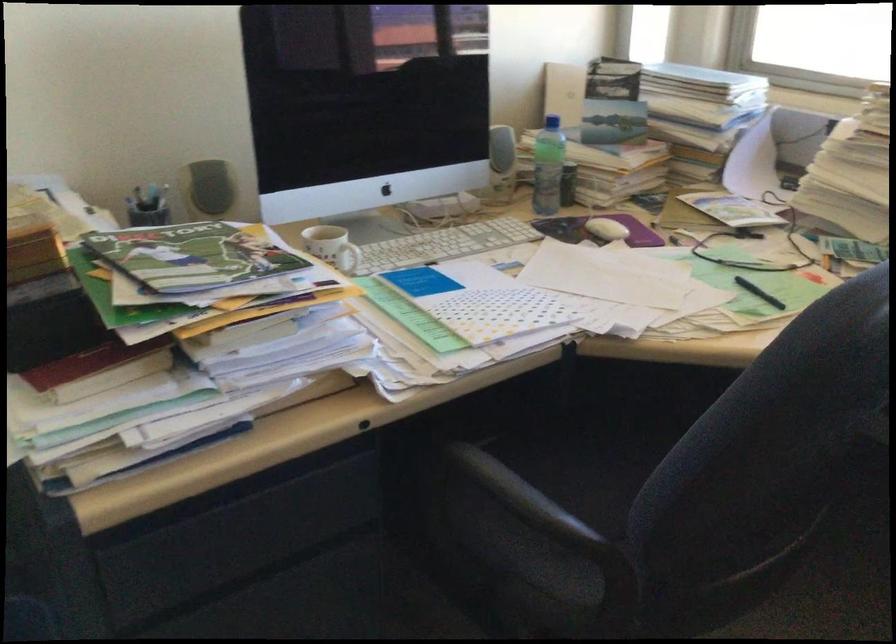
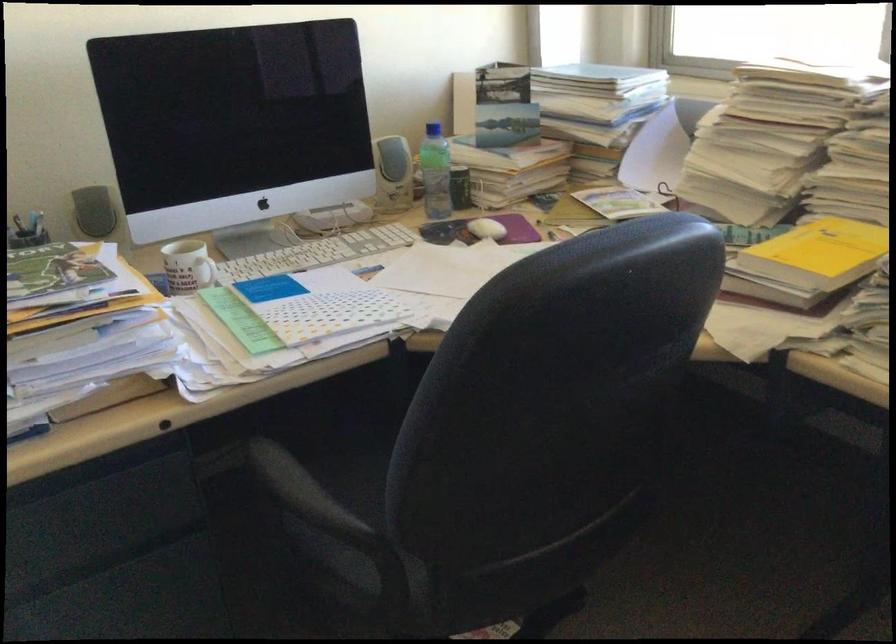
In the second image, find the point that corresponds to pixel 547 532 in the first image.

(314, 521)